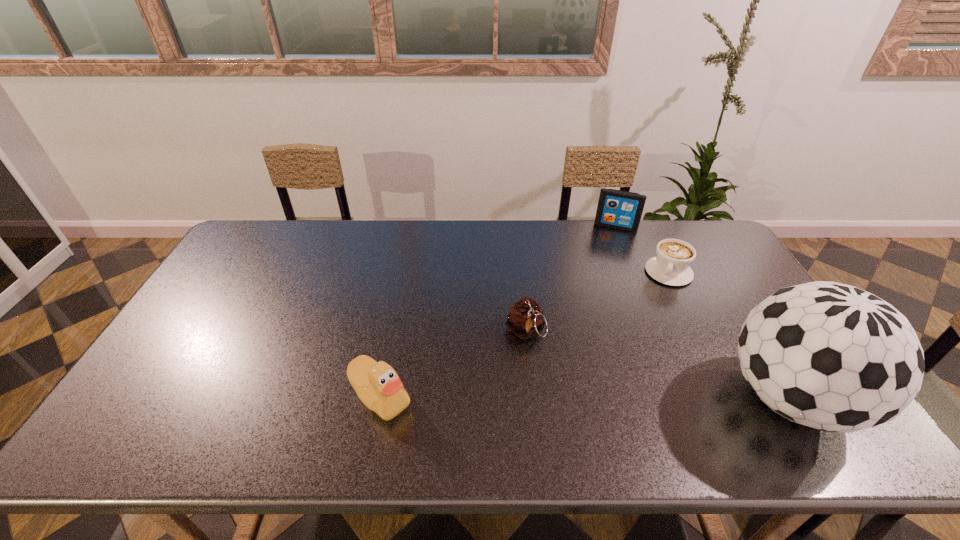
Where is `soccer ball at the near edge`? soccer ball at the near edge is located at coordinates (830, 356).

This screenshot has width=960, height=540. In order to click on object present at the right edge in this screenshot , I will do `click(830, 356)`.

At what (x,y) coordinates should I click in order to perform the action: click on object that is at the near right corner. Please return your answer as a coordinate pair (x, y). Looking at the image, I should click on (830, 356).

In order to click on vacant space at the far edge of the desktop in this screenshot , I will do `click(584, 247)`.

The width and height of the screenshot is (960, 540). In order to click on free spot at the near edge of the desktop in this screenshot , I will do `click(335, 390)`.

This screenshot has height=540, width=960. In order to click on free space at the right edge of the desktop in this screenshot , I will do `click(731, 284)`.

This screenshot has height=540, width=960. In order to click on blank region between the fourth tallest object and the duck in this screenshot , I will do `click(453, 364)`.

At what (x,y) coordinates should I click in order to perform the action: click on free space between the shortest object and the fourth tallest object. Please return your answer as a coordinate pair (x, y). Looking at the image, I should click on (597, 302).

Identify the location of free space between the second shortest object and the second farthest object. The height and width of the screenshot is (540, 960). click(597, 302).

The image size is (960, 540). I want to click on vacant point located between the cappuccino and the soccer ball, so click(729, 335).